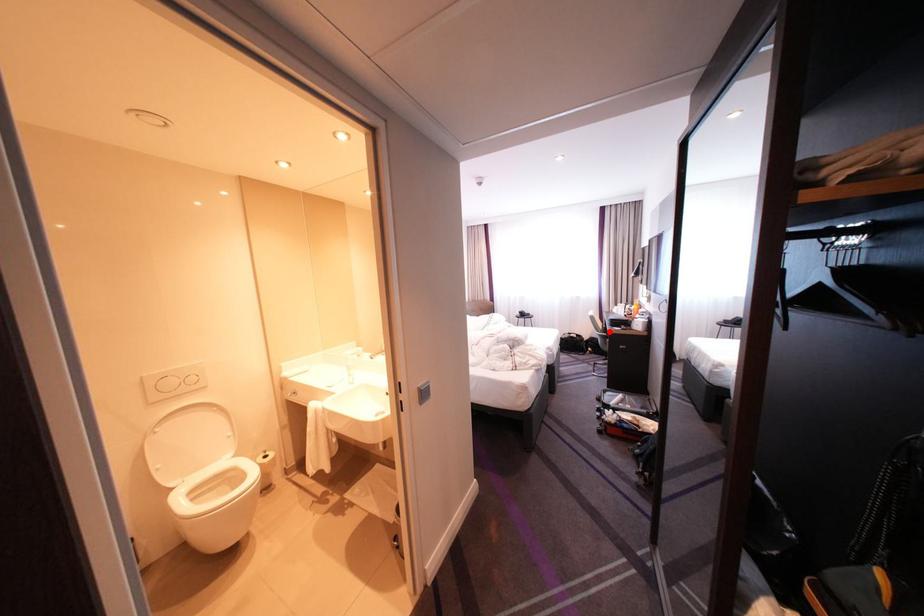
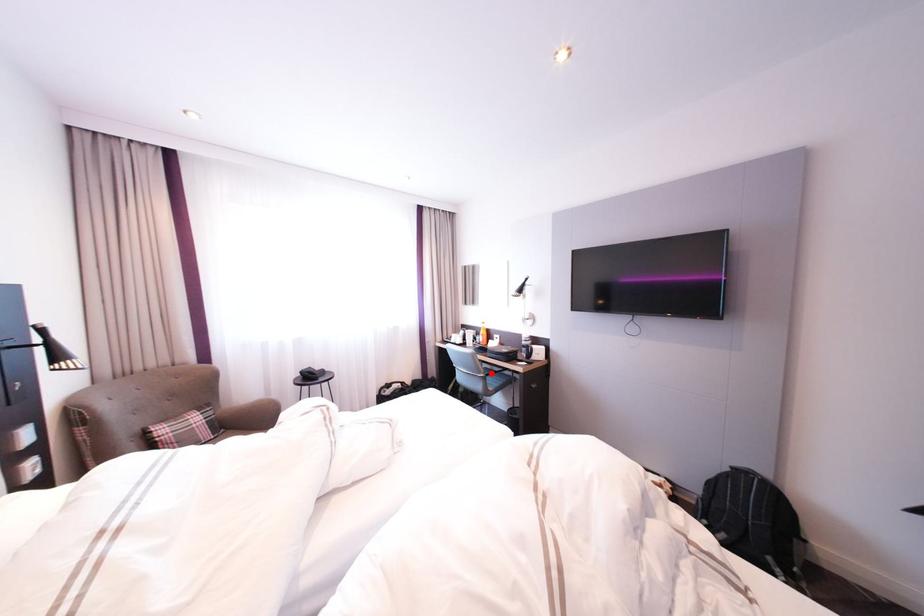
I am providing you with two images of the same scene from different viewpoints. A red point is marked on the first image and another point is marked on the second image. Is the red point in image1 aligned with the point shown in image2?

Yes